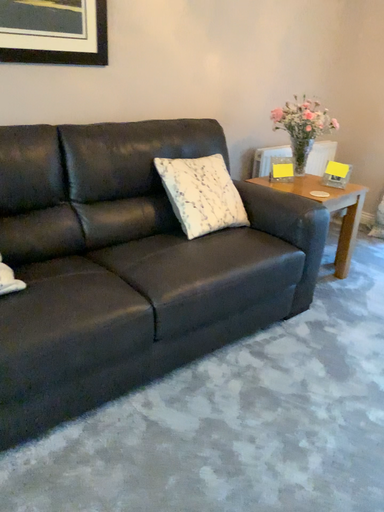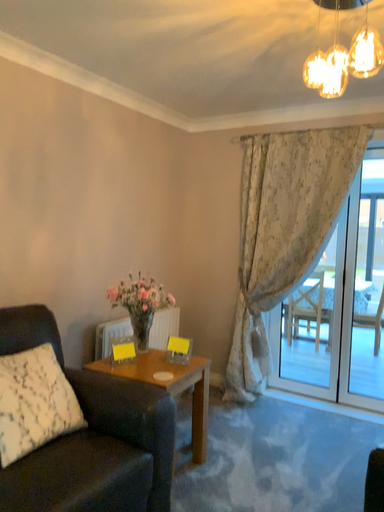
Question: How did the camera likely rotate when shooting the video?

Choices:
 (A) rotated downward
 (B) rotated upward

Answer: (B)